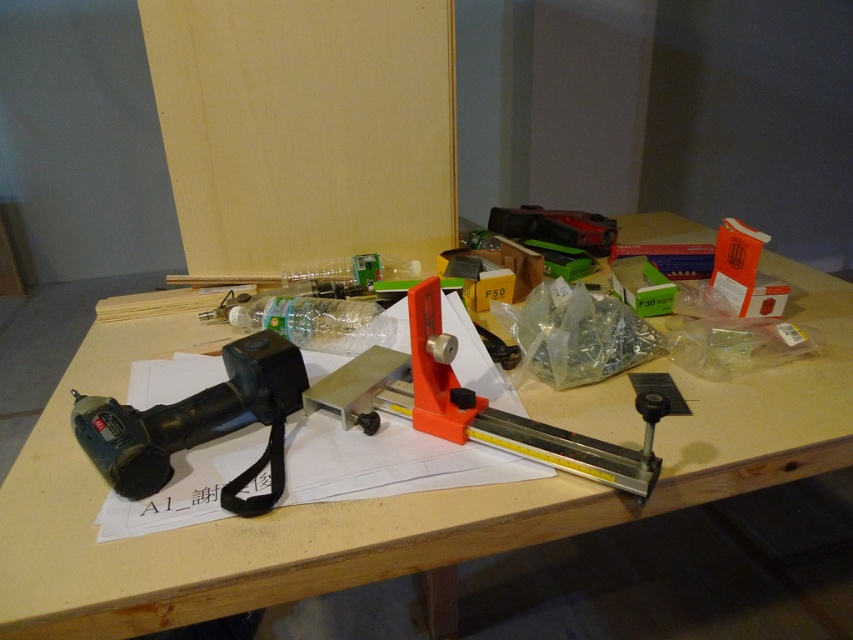
Question: Observing the image, what is the correct spatial positioning of wooden table at center in reference to orange plastic ruler at center?

Choices:
 (A) right
 (B) left

Answer: (A)

Question: Is wooden table at center positioned at the back of black plastic drill at left?

Choices:
 (A) no
 (B) yes

Answer: (A)

Question: Which object is the farthest from the orange plastic ruler at center?

Choices:
 (A) wooden table at center
 (B) black plastic drill at left

Answer: (A)

Question: Is wooden table at center positioned in front of black plastic drill at left?

Choices:
 (A) yes
 (B) no

Answer: (A)

Question: Which point is farther to the camera?

Choices:
 (A) (728, 436)
 (B) (440, 404)
 (C) (149, 483)

Answer: (A)

Question: Which point appears farthest from the camera in this image?

Choices:
 (A) (341, 552)
 (B) (196, 400)
 (C) (426, 388)

Answer: (C)